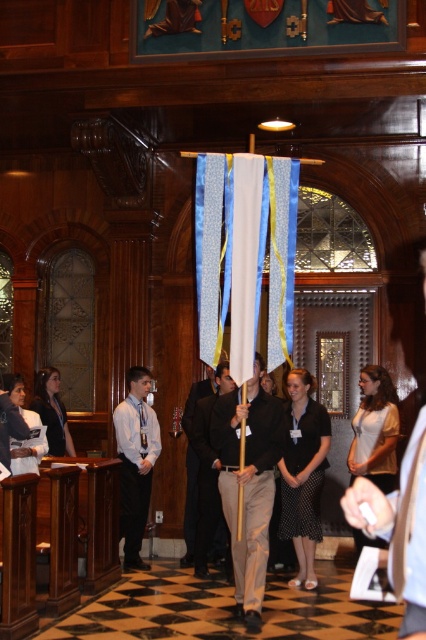
Question: From the image, what is the correct spatial relationship of matte black shirt at center in relation to white fabric at center?

Choices:
 (A) right
 (B) left

Answer: (B)

Question: Based on their relative distances, which object is farther from the light blue shirt at center?

Choices:
 (A) white fabric at center
 (B) matte black shirt at center

Answer: (A)

Question: Which point is farther from the camera taking this photo?

Choices:
 (A) (206, 410)
 (B) (146, 492)
 (C) (411, 476)

Answer: (B)

Question: Considering the relative positions of matte black shirt at center and white fabric at center in the image provided, where is matte black shirt at center located with respect to white fabric at center?

Choices:
 (A) right
 (B) left

Answer: (B)

Question: Among these points, which one is farthest from the camera?

Choices:
 (A) (120, 536)
 (B) (342, 508)
 (C) (204, 401)

Answer: (B)

Question: Can you confirm if white fabric at center is positioned to the right of black fabric at center?

Choices:
 (A) yes
 (B) no

Answer: (A)